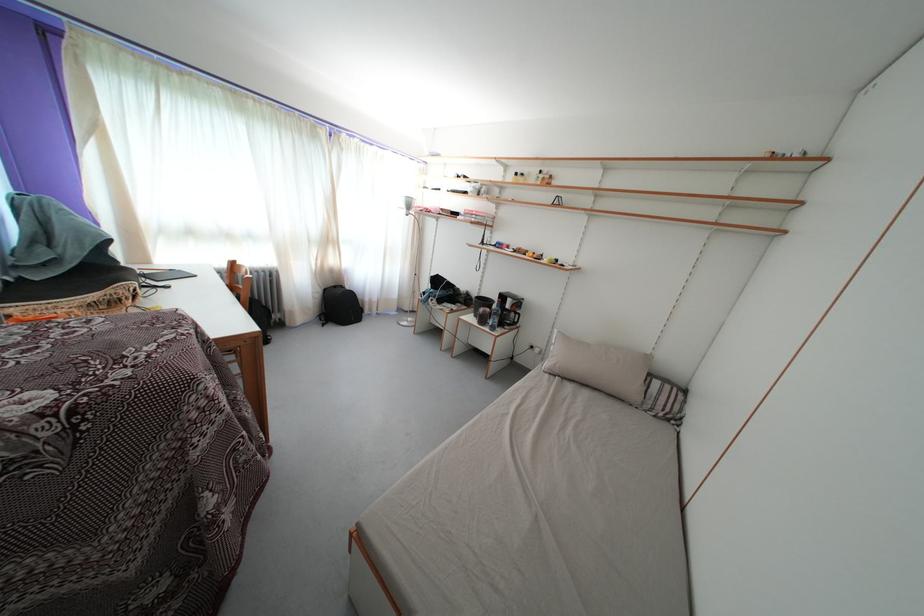
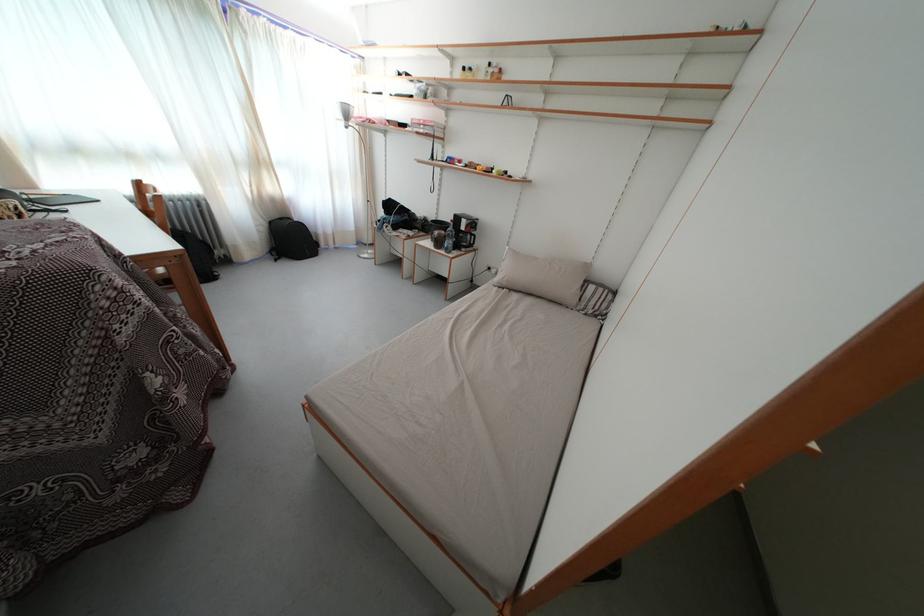
The point at (489, 326) is marked in the first image. Where is the corresponding point in the second image?

(444, 249)